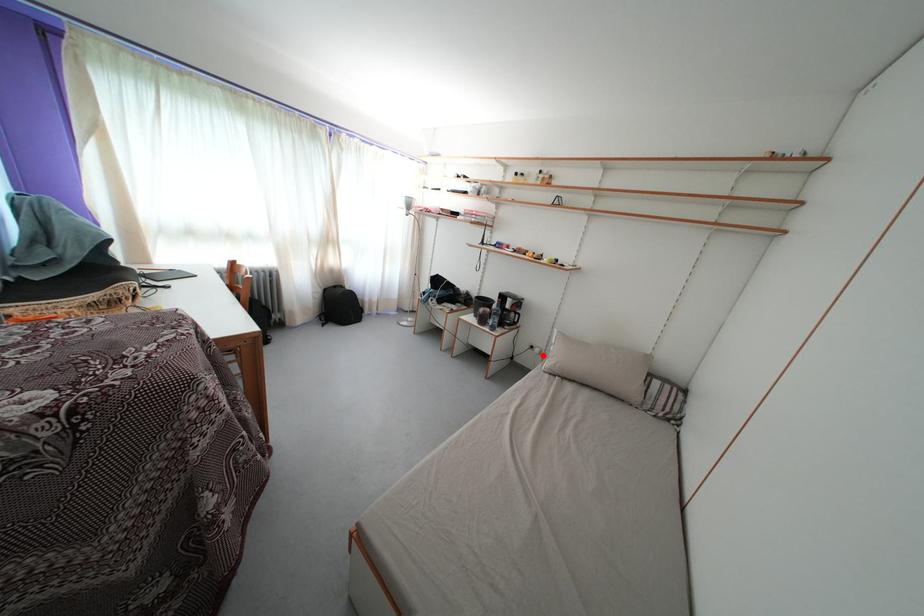
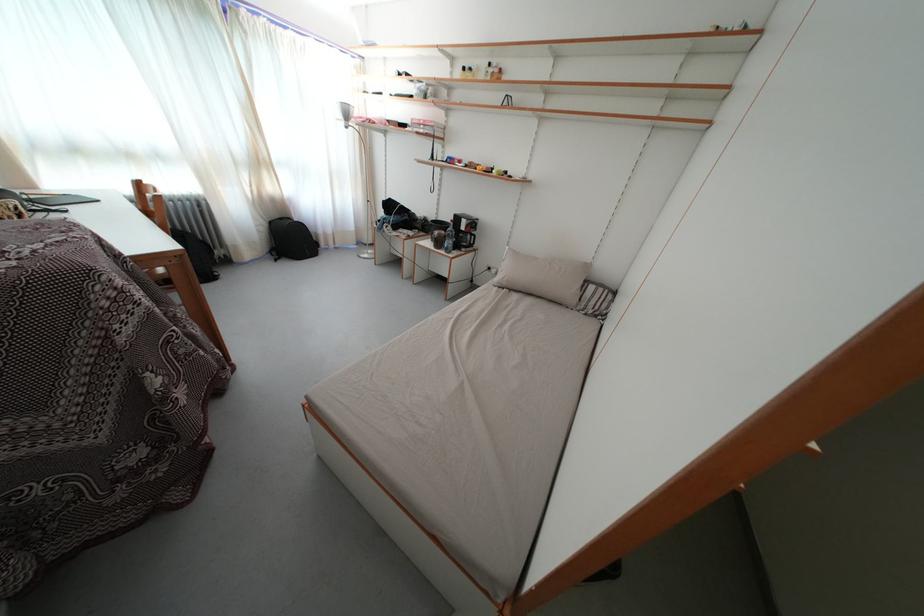
Where in the second image is the point corresponding to the highlighted location from the first image?

(500, 276)